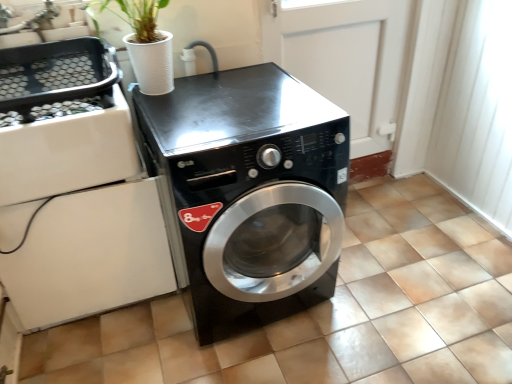
The image size is (512, 384). What are the coordinates of `vacant space to the right of black glossy washing machine at center` in the screenshot? It's located at (389, 284).